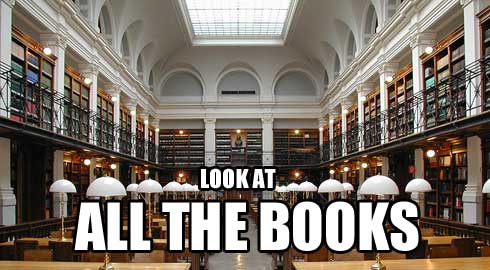
The height and width of the screenshot is (270, 490). I want to click on statue on wall second level, so click(239, 141).